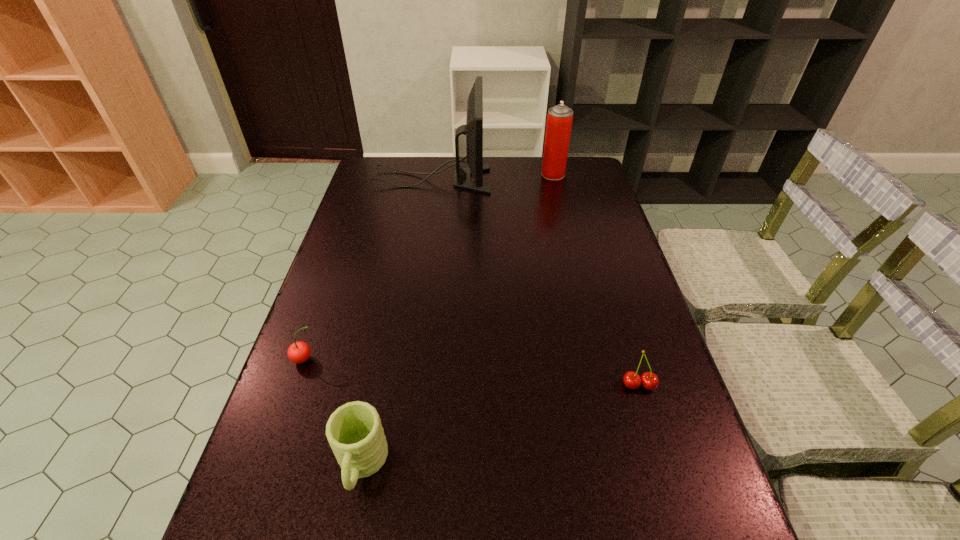
Identify the location of vacant space at the far edge of the desktop. The width and height of the screenshot is (960, 540). (461, 163).

At what (x,y) coordinates should I click in order to perform the action: click on vacant space at the left edge of the desktop. Please return your answer as a coordinate pair (x, y). Looking at the image, I should click on (375, 201).

The image size is (960, 540). In the image, there is a desktop. Find the location of `vacant area at the right edge`. vacant area at the right edge is located at coordinates (606, 381).

At what (x,y) coordinates should I click in order to perform the action: click on vacant point at the far right corner. Please return your answer as a coordinate pair (x, y). The width and height of the screenshot is (960, 540). Looking at the image, I should click on (583, 158).

Where is `blank region between the aerosol can and the second nearest object`? This screenshot has width=960, height=540. blank region between the aerosol can and the second nearest object is located at coordinates (596, 280).

Find the location of a particular element. free spot between the left cherry and the aerosol can is located at coordinates (429, 267).

This screenshot has height=540, width=960. Find the location of `vacant area between the aerosol can and the right cherry`. vacant area between the aerosol can and the right cherry is located at coordinates (596, 280).

Find the location of a particular element. This screenshot has height=540, width=960. vacant space that is in between the computer monitor and the aerosol can is located at coordinates (492, 177).

Locate an element on the screen. The width and height of the screenshot is (960, 540). vacant space in between the computer monitor and the nearest object is located at coordinates (396, 322).

You are a GUI agent. You are given a task and a screenshot of the screen. Output one action in this format:
    pyautogui.click(x=<x>, y=<y>)
    Task: Click on the empty space that is in between the third nearest object and the aerosol can
    The image size is (960, 540).
    Given the screenshot: What is the action you would take?
    pyautogui.click(x=429, y=267)